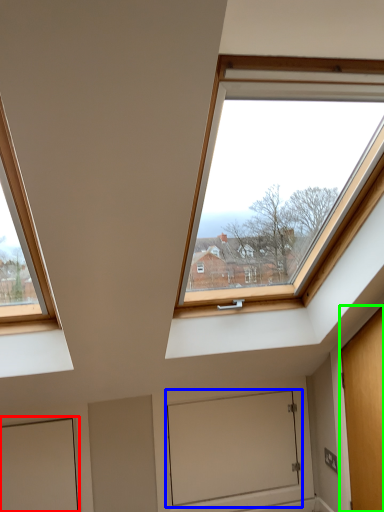
Question: Considering the real-world distances, which object is farthest from door (highlighted by a red box)? window screen (highlighted by a blue box) or door (highlighted by a green box)?

Choices:
 (A) window screen
 (B) door

Answer: (B)